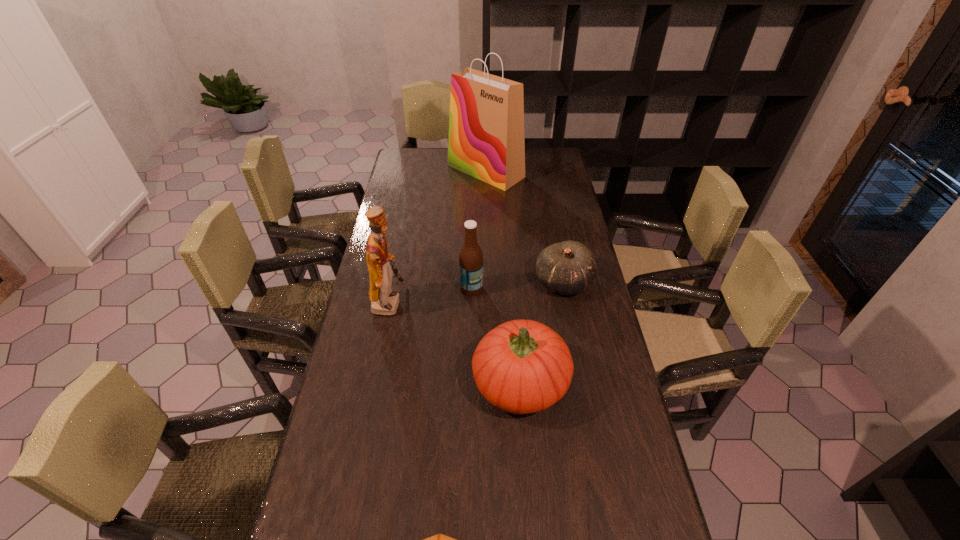
Find the location of `free region that satisfies the following two spatial constraints: 1. on the front side of the third tallest object; 2. on the right side of the third shortest object`. free region that satisfies the following two spatial constraints: 1. on the front side of the third tallest object; 2. on the right side of the third shortest object is located at coordinates (469, 382).